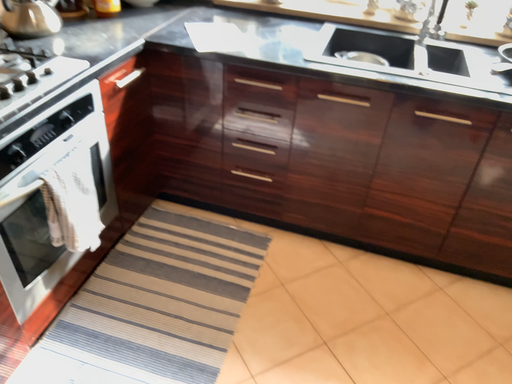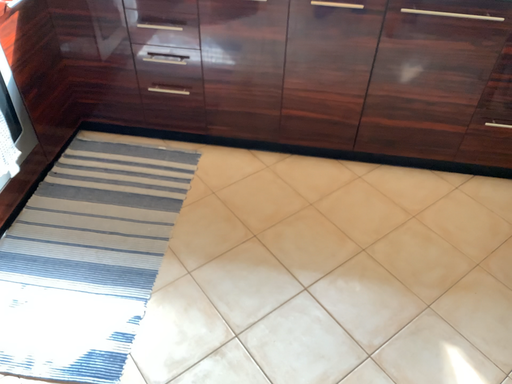
Question: Which way did the camera rotate in the video?

Choices:
 (A) rotated downward
 (B) rotated upward

Answer: (A)